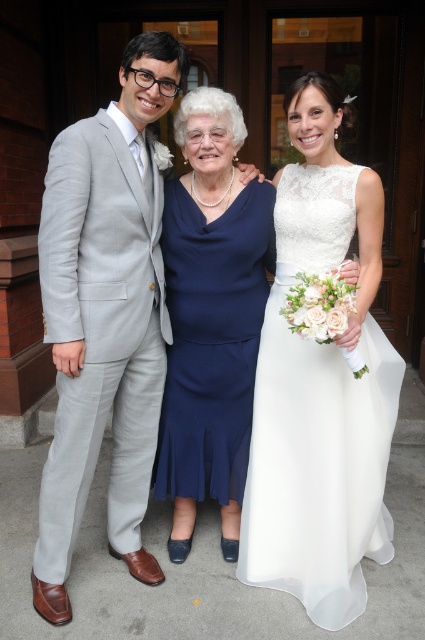
Does light gray suit at left have a lesser height compared to navy satin dress at center?

No.

Which is in front, point (152, 228) or point (244, 344)?

Point (152, 228) is in front.

Image resolution: width=425 pixels, height=640 pixels. What are the coordinates of `light gray suit at left` in the screenshot? It's located at [x=104, y=316].

Is point (357, 476) farther from camera compared to point (33, 589)?

No.

Who is more distant from viewer, (285, 468) or (161, 401)?

Positioned behind is point (161, 401).

Which is behind, point (342, 376) or point (59, 184)?

The point (342, 376) is more distant.

The height and width of the screenshot is (640, 425). I want to click on white lace dress at center, so click(x=320, y=385).

Which is behind, point (278, 582) or point (212, 371)?

Positioned behind is point (212, 371).

Does white lace dress at center appear over navy satin dress at center?

Yes.

What do you see at coordinates (320, 385) in the screenshot? Image resolution: width=425 pixels, height=640 pixels. I see `white lace dress at center` at bounding box center [320, 385].

This screenshot has width=425, height=640. I want to click on white lace dress at center, so click(x=320, y=385).